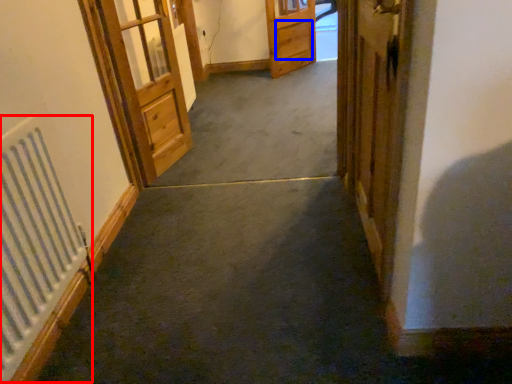
Question: Which point is further to the camera, radiator (highlighted by a red box) or drawer (highlighted by a blue box)?

Choices:
 (A) radiator
 (B) drawer

Answer: (B)